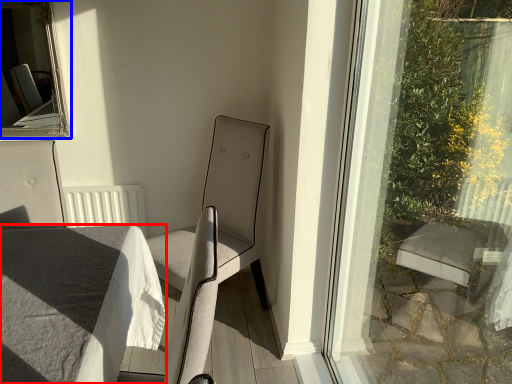
Question: Which point is further to the camera, table (highlighted by a red box) or bay window (highlighted by a blue box)?

Choices:
 (A) table
 (B) bay window

Answer: (B)